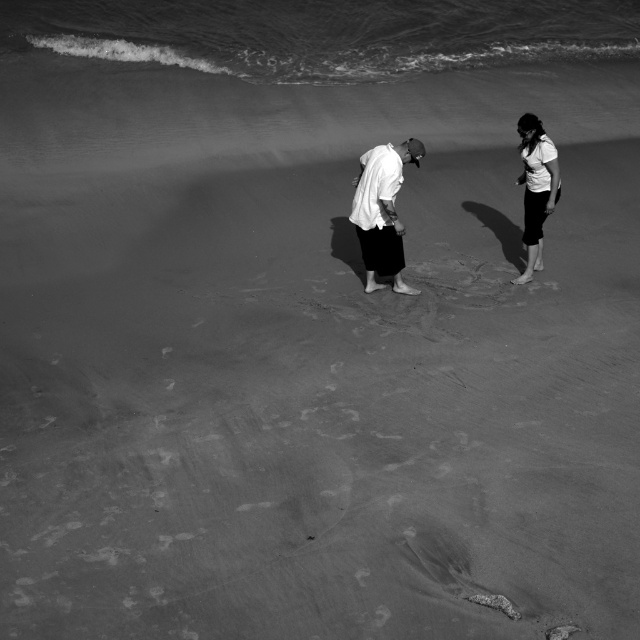
Question: Which point is closer to the camera taking this photo?

Choices:
 (A) (541, 164)
 (B) (552, 147)

Answer: (B)

Question: Which point is closer to the camera?

Choices:
 (A) (532, 268)
 (B) (380, 160)

Answer: (B)

Question: Is white matte shirt at center positioned behind white matte shirt at right?

Choices:
 (A) no
 (B) yes

Answer: (A)

Question: Among these objects, which one is farthest from the camera?

Choices:
 (A) white cotton shirt at center
 (B) white matte shirt at center

Answer: (A)

Question: Is white cotton shirt at center smaller than white matte shirt at right?

Choices:
 (A) no
 (B) yes

Answer: (A)

Question: Is white matte shirt at center wider than white matte shirt at right?

Choices:
 (A) no
 (B) yes

Answer: (B)